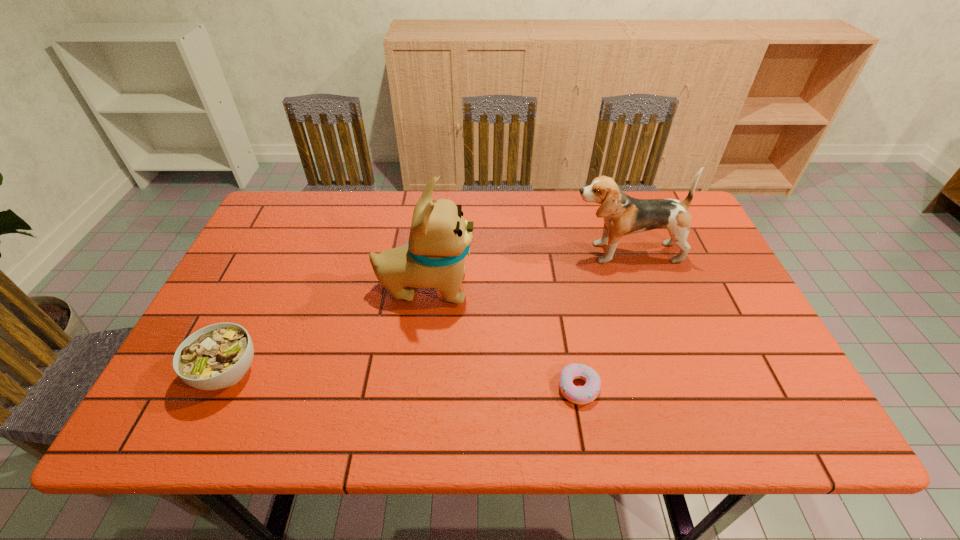
Where is `free space at the right edge of the desktop`? This screenshot has height=540, width=960. free space at the right edge of the desktop is located at coordinates 723,311.

Locate an element on the screen. The width and height of the screenshot is (960, 540). free location at the near right corner of the desktop is located at coordinates (781, 427).

This screenshot has width=960, height=540. What are the coordinates of `empty space between the nearer puppy and the doughnut` in the screenshot? It's located at (502, 338).

Where is `vacant space that's between the leftmost object and the shortest object`? The height and width of the screenshot is (540, 960). vacant space that's between the leftmost object and the shortest object is located at coordinates 403,380.

Find the location of `unoccupied area between the doughnut and the right puppy`. unoccupied area between the doughnut and the right puppy is located at coordinates (602, 320).

At what (x,y) coordinates should I click in order to perform the action: click on vacant region between the doughnut and the farthest object. Please return your answer as a coordinate pair (x, y). The width and height of the screenshot is (960, 540). Looking at the image, I should click on (602, 320).

You are a GUI agent. You are given a task and a screenshot of the screen. Output one action in this format:
    pyautogui.click(x=<x>, y=<y>)
    Task: Click on the unoccupied area between the doughnut and the second farthest object
    This screenshot has width=960, height=540.
    Given the screenshot: What is the action you would take?
    pyautogui.click(x=502, y=338)

The height and width of the screenshot is (540, 960). Identify the location of vacant area that lies between the left puppy and the farther puppy. (525, 270).

Identify the location of free space between the left puppy and the farther puppy. (525, 270).

The width and height of the screenshot is (960, 540). Find the location of `vacant space that's between the right puppy and the left puppy`. vacant space that's between the right puppy and the left puppy is located at coordinates (525, 270).